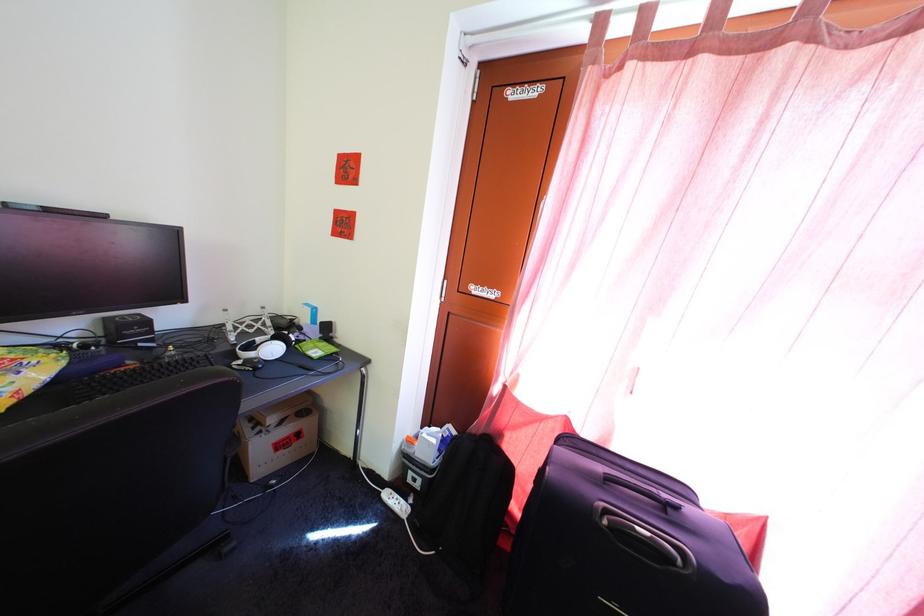
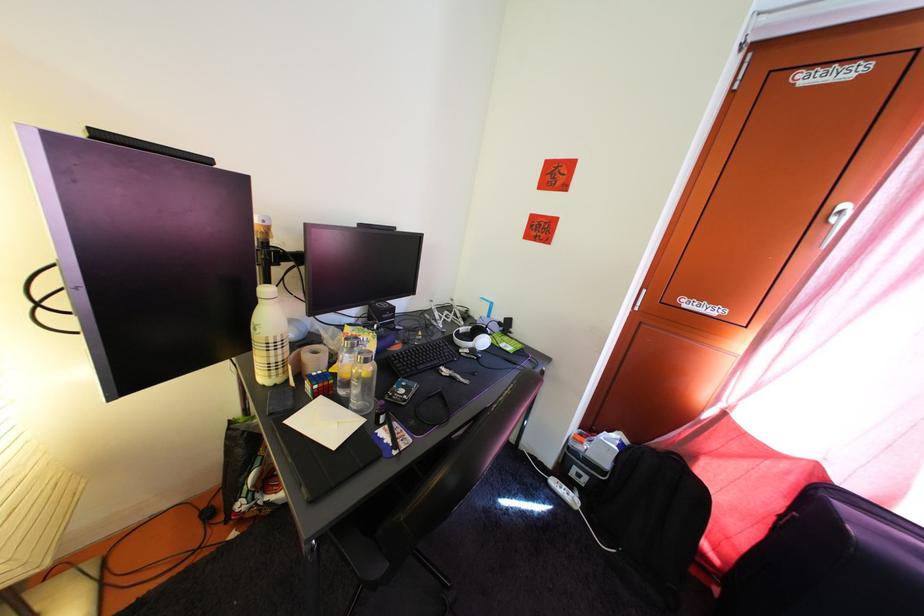
Question: The images are taken continuously from a first-person perspective. In which direction is your viewpoint rotating?

Choices:
 (A) Left
 (B) Right
 (C) Up
 (D) Down

Answer: (A)